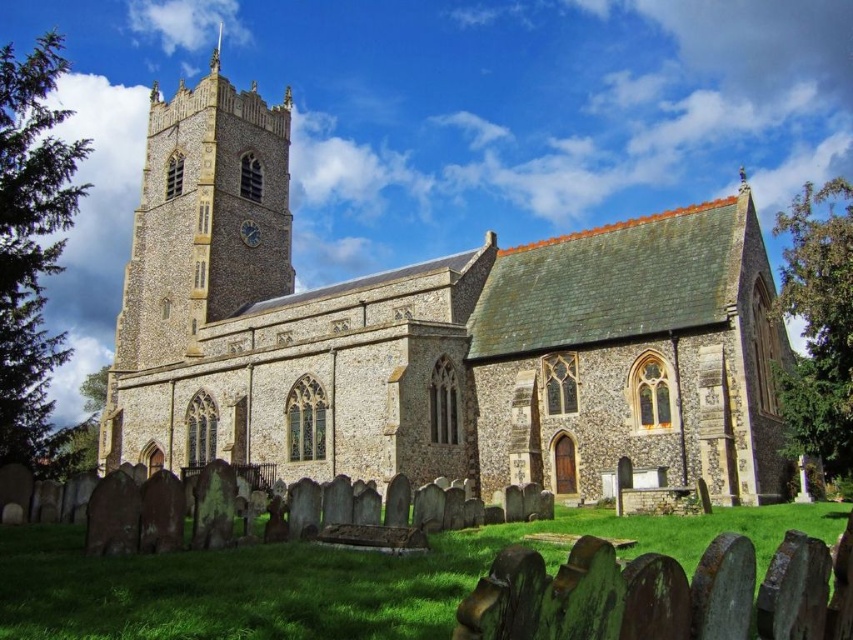
Is point (189, 116) farther from viewer compared to point (218, 33)?

No, (189, 116) is closer to viewer.

Does brown stone clock tower at upper left appear on the left side of smooth silver spire at upper center?

No, brown stone clock tower at upper left is not to the left of smooth silver spire at upper center.

Identify the location of brown stone clock tower at upper left. (204, 220).

Is stone church at center behind metallic clock face at upper center?

No, stone church at center is closer to the viewer.

Which is behind, point (677, 305) or point (250, 232)?

Point (250, 232)

Find the location of a particular element. stone church at center is located at coordinates (436, 339).

Which is behind, point (635, 376) or point (241, 131)?

The point (241, 131) is behind.

Is point (216, 385) behind point (270, 131)?

No, it is in front of (270, 131).

Find the location of a particular element. Image resolution: width=853 pixels, height=640 pixels. stone church at center is located at coordinates (436, 339).